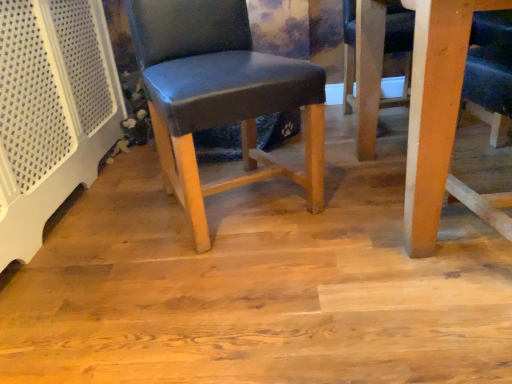
I want to click on vacant space to the left of matte blue leather chair at center, so click(x=114, y=221).